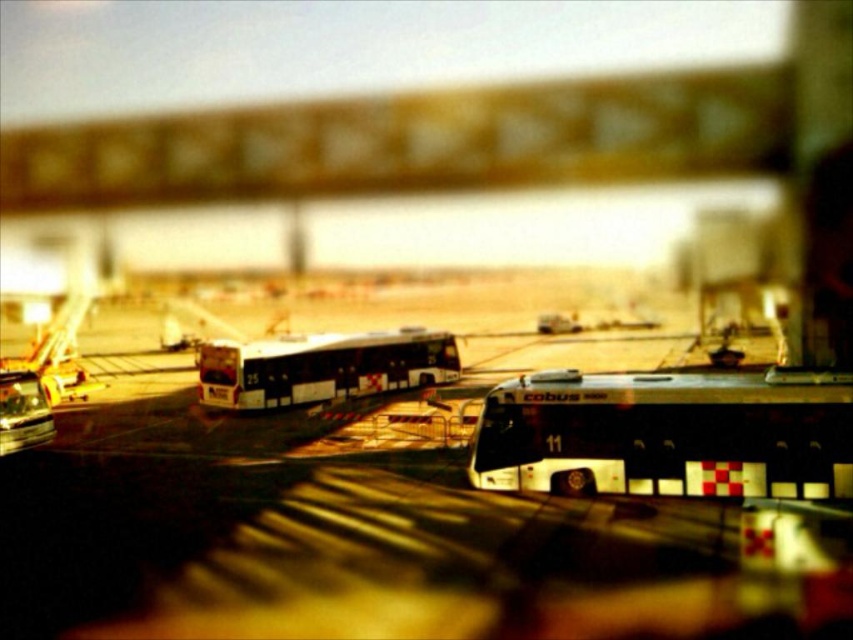
You are a photographer who wants to capture both the metallic signboard at upper center and the white glossy bus at center in a single frame. Based on their sizes in the image, which object should you focus on first to ensure both are in focus?

The metallic signboard at upper center is wider than the white glossy bus at center. Since the signboard is wider, focusing on it first would help ensure both objects are in focus as it requires a larger depth of field coverage.

You are a delivery driver who needs to park your truck between the white matte bus at center and the white glossy bus at center. The truck is 50 feet long. Is there enough space between the two buses to park your truck?

The distance between the white matte bus at center and the white glossy bus at center is 54.54 feet. Since the truck is 50 feet long, there is enough space to park between them.

You are a photographer who wants to capture the white glossy bus at center without the metallic signboard at upper center appearing in the frame. Based on their positions, is this possible?

The metallic signboard at upper center is above the white glossy bus at center, so if you position the camera to capture the bus from a lower angle, you can frame the shot so the signboard is out of view. Alternatively, moving to the side might also help avoid the signboard.